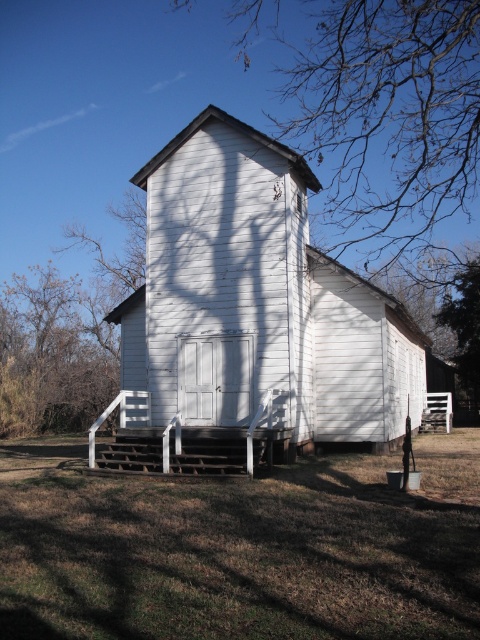
Does white wooden church at center have a lesser height compared to green leafy tree at right?

Yes.

Can you confirm if white wooden church at center is thinner than green leafy tree at right?

No.

Identify the location of white wooden church at center. (249, 317).

Does point (343, 83) come farther from viewer compared to point (465, 280)?

No, it is not.

Can you confirm if bare branches at upper center is positioned below green leafy tree at right?

Incorrect, bare branches at upper center is not positioned below green leafy tree at right.

Does point (316, 132) lie behind point (467, 264)?

Yes.

At what (x,y) coordinates should I click in order to perform the action: click on bare branches at upper center. Please return your answer as a coordinate pair (x, y). Image resolution: width=480 pixels, height=640 pixels. Looking at the image, I should click on (389, 116).

Is white wooden church at center shorter than bare branches at upper center?

Yes.

Who is taller, white wooden church at center or bare branches at upper center?

bare branches at upper center is taller.

This screenshot has height=640, width=480. I want to click on white wooden church at center, so click(x=249, y=317).